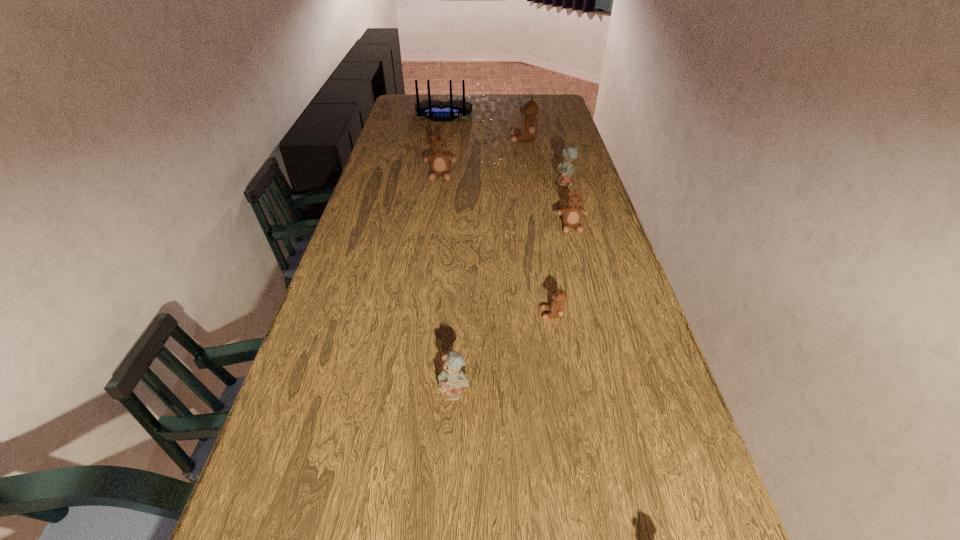
Where is `router`? This screenshot has height=540, width=960. router is located at coordinates (435, 110).

This screenshot has height=540, width=960. I want to click on black router, so click(x=435, y=110).

What are the coordinates of `the tallest teddy bear` in the screenshot? It's located at (529, 128).

Locate an element on the screen. This screenshot has height=540, width=960. the biggest brown teddy bear is located at coordinates (529, 128).

Locate an element on the screen. This screenshot has height=540, width=960. the bigger blue teddy bear is located at coordinates pyautogui.click(x=565, y=169).

Locate an element on the screen. Image resolution: width=960 pixels, height=540 pixels. the right blue teddy bear is located at coordinates (565, 169).

Locate an element on the screen. Image resolution: width=960 pixels, height=540 pixels. the third nearest brown teddy bear is located at coordinates (440, 162).

At what (x,y) coordinates should I click in order to perform the action: click on the leftmost brown teddy bear. Please return your answer as a coordinate pair (x, y). This screenshot has width=960, height=540. Looking at the image, I should click on (440, 162).

This screenshot has width=960, height=540. Identify the location of the third biggest brown teddy bear. (572, 214).

Find the location of a particular element. The width and height of the screenshot is (960, 540). the third nearest teddy bear is located at coordinates (572, 214).